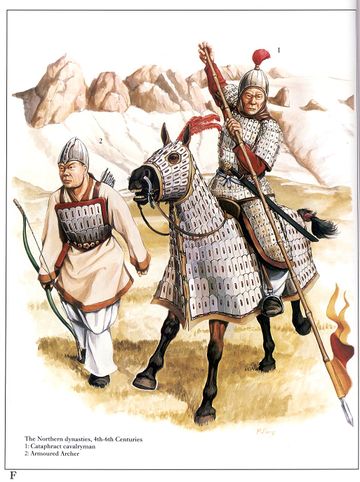
I want to click on painting description, so click(43, 438).